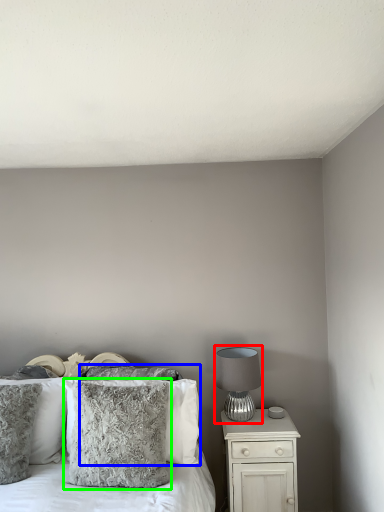
Question: Based on their relative distances, which object is nearer to table lamp (highlighted by a red box)? Choose from pillow (highlighted by a blue box) and pillow (highlighted by a green box).

Choices:
 (A) pillow
 (B) pillow

Answer: (A)